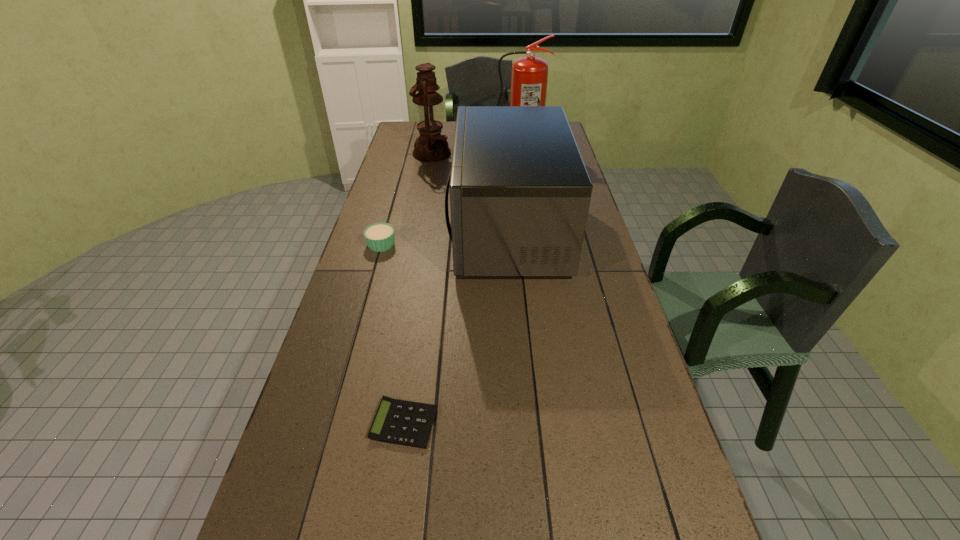
Find the location of a particular element. vacant space situated 0.140m on the front-facing side of the microwave oven is located at coordinates (412, 230).

The height and width of the screenshot is (540, 960). Identify the location of free region located 0.330m on the right of the cupcake. (491, 244).

You are a GUI agent. You are given a task and a screenshot of the screen. Output one action in this format:
    pyautogui.click(x=<x>, y=<y>)
    Task: Click on the free space located 0.240m on the back of the calculator
    This screenshot has width=960, height=540.
    Given the screenshot: What is the action you would take?
    pyautogui.click(x=418, y=326)

This screenshot has width=960, height=540. Find the location of `oil lamp at the left edge`. oil lamp at the left edge is located at coordinates (430, 146).

I want to click on cupcake that is at the left edge, so point(379,237).

Identify the location of fire extinguisher that is at the right edge. This screenshot has height=540, width=960. (529, 77).

In order to click on microwave oven located at the right edge in this screenshot , I will do `click(520, 193)`.

In the image, there is a desktop. In order to click on vacant space at the left edge in this screenshot , I will do `click(392, 161)`.

What are the coordinates of `vacant region at the right edge` in the screenshot? It's located at (671, 465).

Image resolution: width=960 pixels, height=540 pixels. In order to click on vacant space that is in between the microwave oven and the second shortest object in this screenshot , I will do `click(444, 237)`.